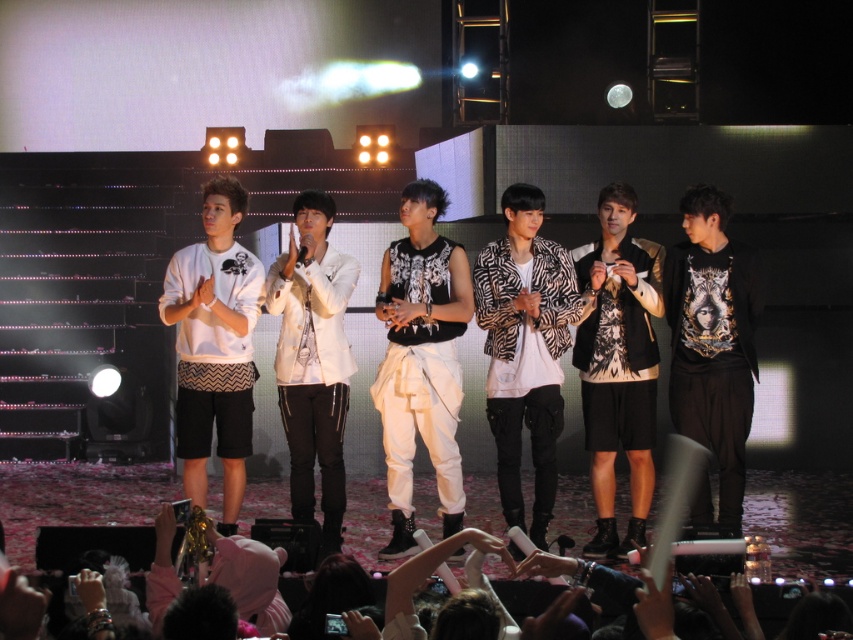
Consider the image. You are a photographer positioned at the front of the stage. You need to capture a photo where both the black printed hoodie at right and the pink fabric at lower center are visible. Based on their heights, which object will appear larger in the photo?

The black printed hoodie at right is taller than the pink fabric at lower center, so it will appear larger in the photo.

You are a photographer standing at the center of the stage. You notice a printed jersey at center marked by point (618, 365). If you want to take a photo that includes both the printed jersey at center and the large screen in the background, which direction should you move to ensure both are in frame?

The printed jersey at center is located at point (618, 365). To include both the printed jersey at center and the large screen in the background, the photographer should move towards the center of the stage to ensure both elements are within the camera frame.